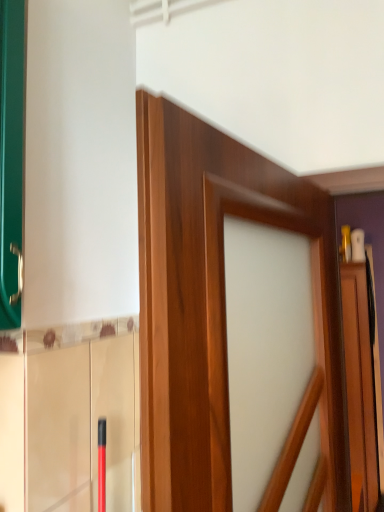
In order to click on wooden door at center in this screenshot , I will do `click(212, 301)`.

The width and height of the screenshot is (384, 512). Describe the element at coordinates (212, 301) in the screenshot. I see `wooden door at center` at that location.

In order to face wooden door at center, should I rotate leftwards or rightwards?

It's best to rotate right around 15.554 degrees.

This screenshot has width=384, height=512. Find the location of `wooden door at center`. wooden door at center is located at coordinates (212, 301).